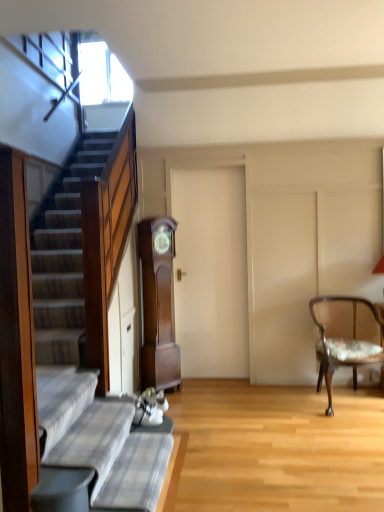
Question: Considering the positions of brown wood grandfather clock at center and plaid fabric couch at lower left in the image, is brown wood grandfather clock at center taller or shorter than plaid fabric couch at lower left?

Choices:
 (A) short
 (B) tall

Answer: (B)

Question: Choose the correct answer: Is brown wood grandfather clock at center inside plaid fabric couch at lower left or outside it?

Choices:
 (A) inside
 (B) outside

Answer: (B)

Question: Based on their relative distances, which object is nearer to the plaid fabric couch at lower left?

Choices:
 (A) brown wood grandfather clock at center
 (B) wooden cane chair with floral cushion at right

Answer: (A)

Question: Which of these objects is positioned closest to the plaid fabric couch at lower left?

Choices:
 (A) brown wood grandfather clock at center
 (B) wooden cane chair with floral cushion at right

Answer: (A)